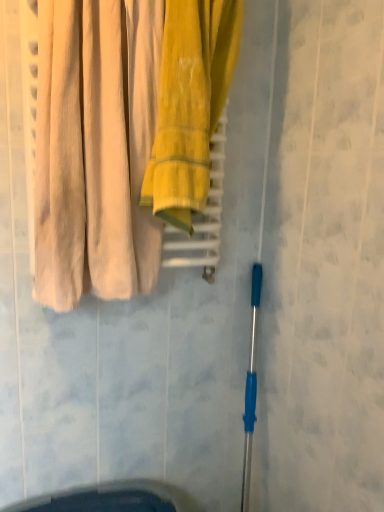
Question: Is beige cotton curtains at left wider than yellow cotton towel at center?

Choices:
 (A) no
 (B) yes

Answer: (B)

Question: Can you confirm if beige cotton curtains at left is taller than yellow cotton towel at center?

Choices:
 (A) yes
 (B) no

Answer: (B)

Question: Is the position of beige cotton curtains at left more distant than that of yellow cotton towel at center?

Choices:
 (A) no
 (B) yes

Answer: (A)

Question: Are beige cotton curtains at left and yellow cotton towel at center located far from each other?

Choices:
 (A) yes
 (B) no

Answer: (B)

Question: Is beige cotton curtains at left next to yellow cotton towel at center?

Choices:
 (A) no
 (B) yes

Answer: (A)

Question: Considering the relative sizes of beige cotton curtains at left and yellow cotton towel at center in the image provided, is beige cotton curtains at left thinner than yellow cotton towel at center?

Choices:
 (A) no
 (B) yes

Answer: (A)

Question: Is yellow cotton towel at center far from beige cotton curtains at left?

Choices:
 (A) yes
 (B) no

Answer: (B)

Question: Is yellow cotton towel at center oriented away from beige cotton curtains at left?

Choices:
 (A) yes
 (B) no

Answer: (B)

Question: Is yellow cotton towel at center with beige cotton curtains at left?

Choices:
 (A) yes
 (B) no

Answer: (B)

Question: Is yellow cotton towel at center outside beige cotton curtains at left?

Choices:
 (A) no
 (B) yes

Answer: (B)

Question: From the image's perspective, does yellow cotton towel at center appear lower than beige cotton curtains at left?

Choices:
 (A) yes
 (B) no

Answer: (B)

Question: Can beige cotton curtains at left be found inside yellow cotton towel at center?

Choices:
 (A) no
 (B) yes

Answer: (A)

Question: Visually, is beige cotton curtains at left positioned to the left or to the right of yellow cotton towel at center?

Choices:
 (A) left
 (B) right

Answer: (A)